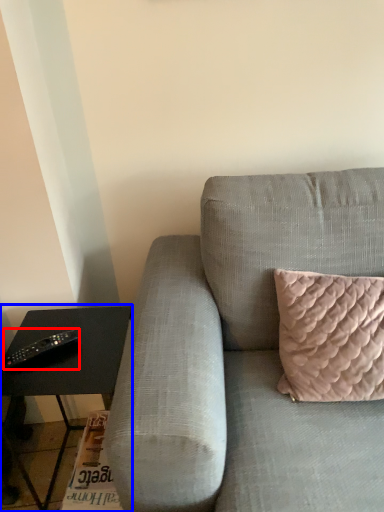
Question: Which point is further to the camera, remote (highlighted by a red box) or table (highlighted by a blue box)?

Choices:
 (A) remote
 (B) table

Answer: (A)